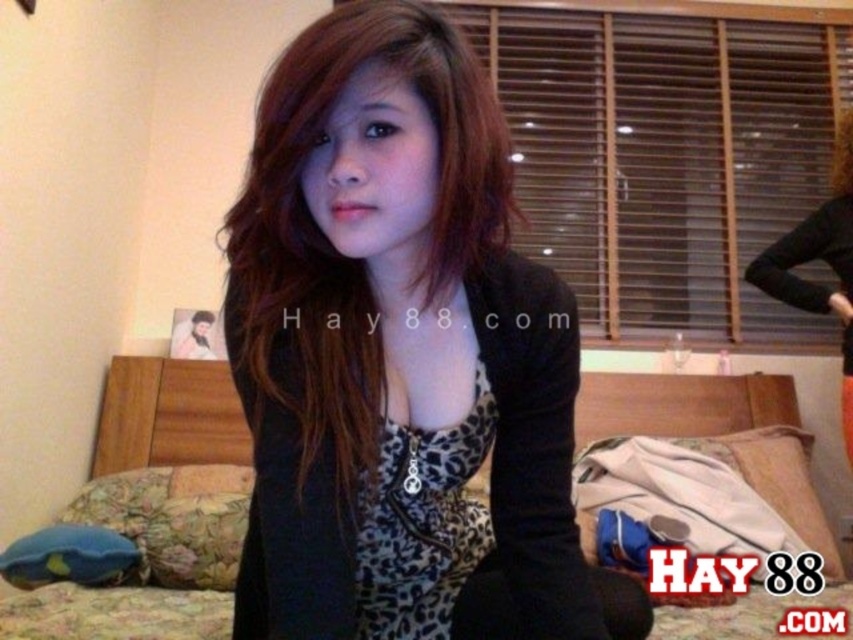
In the scene, you see a matte black jacket at center and a floral fabric bed at center. Which object is positioned to the left side of the other?

The matte black jacket at center is to the left of the floral fabric bed at center.

You are trying to decide whether to place a new rectangular box that is 10 cm thick between the matte black jacket at center and the floral fabric bed at center. Can the box fit in the space between them based on their thickness?

The matte black jacket at center is thinner than the floral fabric bed at center. Since the box is 10 cm thick, but we don not know the exact thickness of either object, we cannot determine if the space between them can accommodate the box.

You are organizing a clothing donation drive and need to decide whether to keep the matte black jacket at center or the floral fabric bed at center. Based on their sizes, which item should you choose to donate if you want to maximize the number of items you can fit in the donation box?

The matte black jacket at center occupies less space than the floral fabric bed at center, so you should donate the floral fabric bed at center to maximize the number of items that can fit in the donation box.